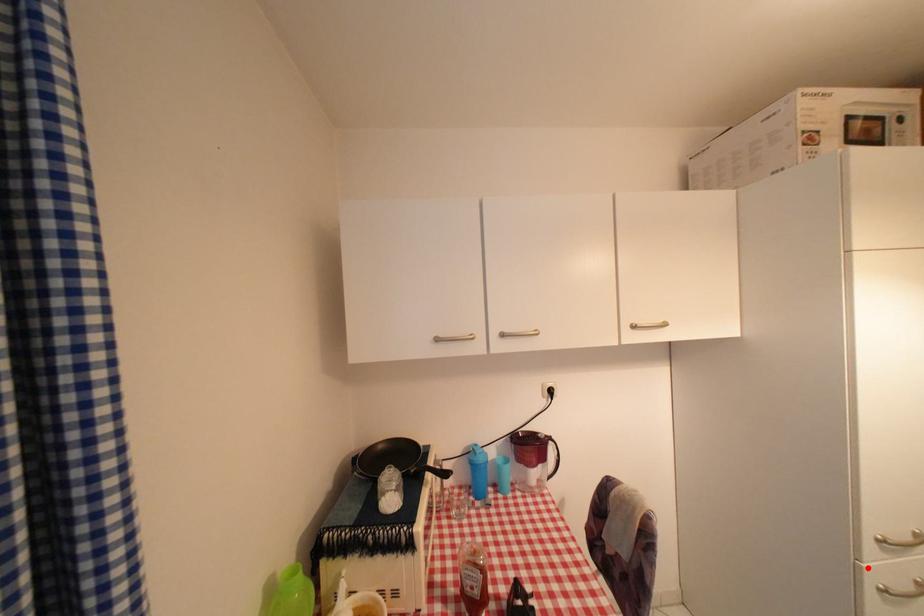
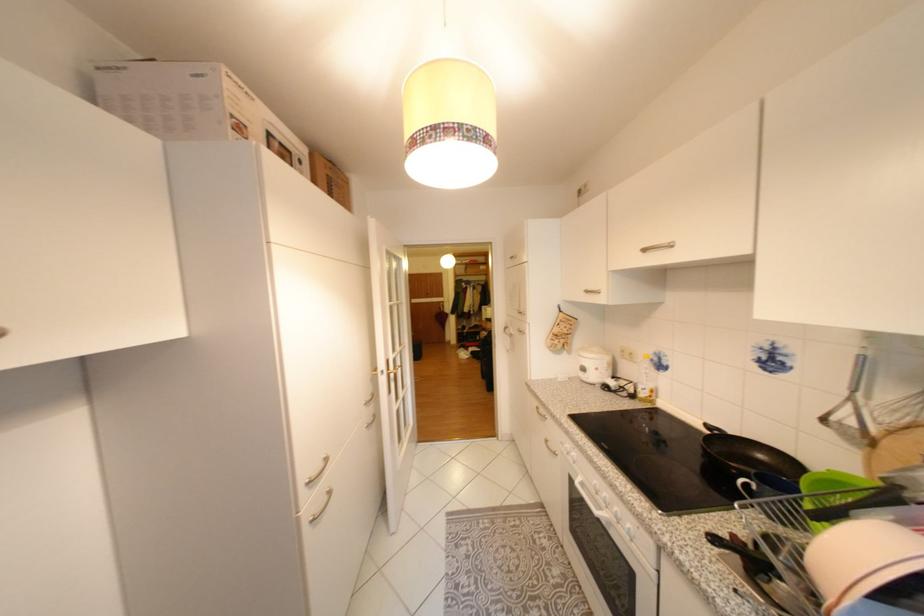
The point at the highlighted location is marked in the first image. Where is the corresponding point in the second image?

(308, 519)